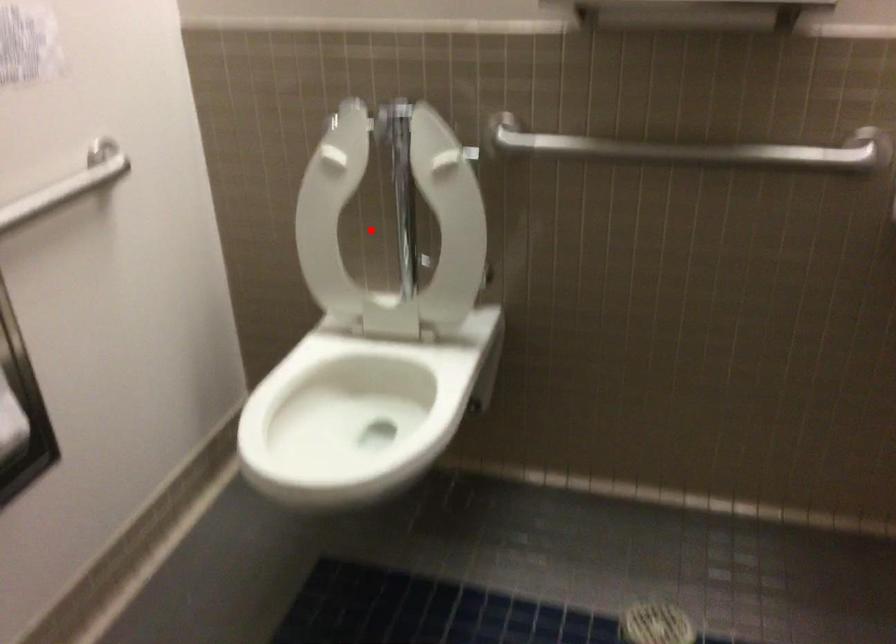
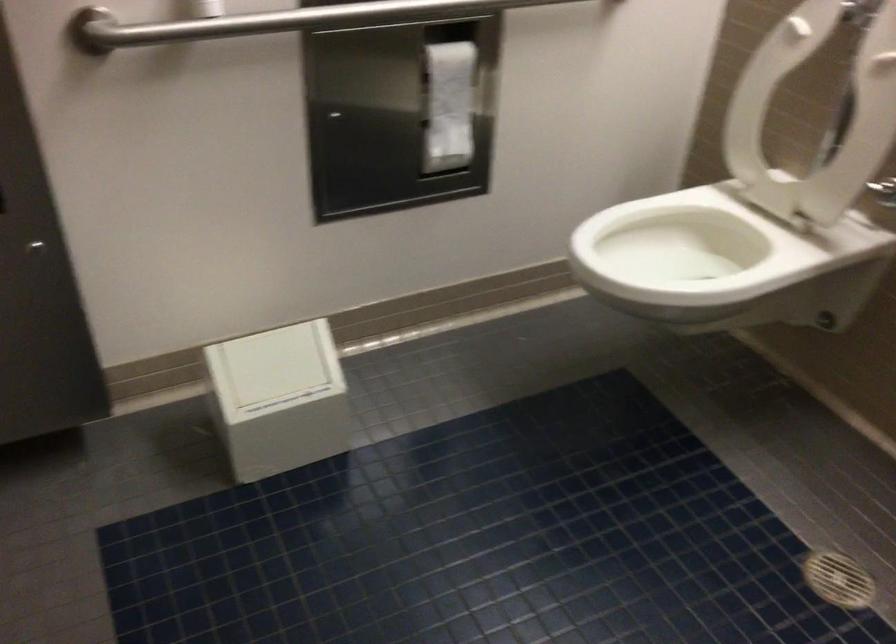
In the second image, find the point that corresponds to the highlighted location in the first image.

(814, 115)